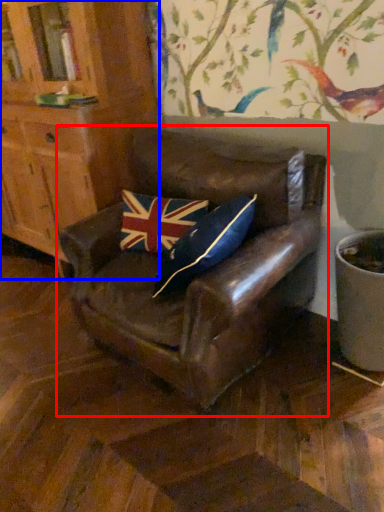
Question: Which object appears farthest to the camera in this image, chair (highlighted by a red box) or cabinetry (highlighted by a blue box)?

Choices:
 (A) chair
 (B) cabinetry

Answer: (B)